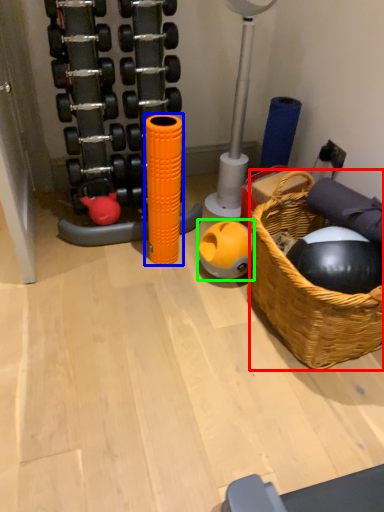
Question: Estimate the real-world distances between objects in this image. Which object is closer to basket (highlighted by a red box), toy (highlighted by a blue box) or ball (highlighted by a green box)?

Choices:
 (A) toy
 (B) ball

Answer: (B)